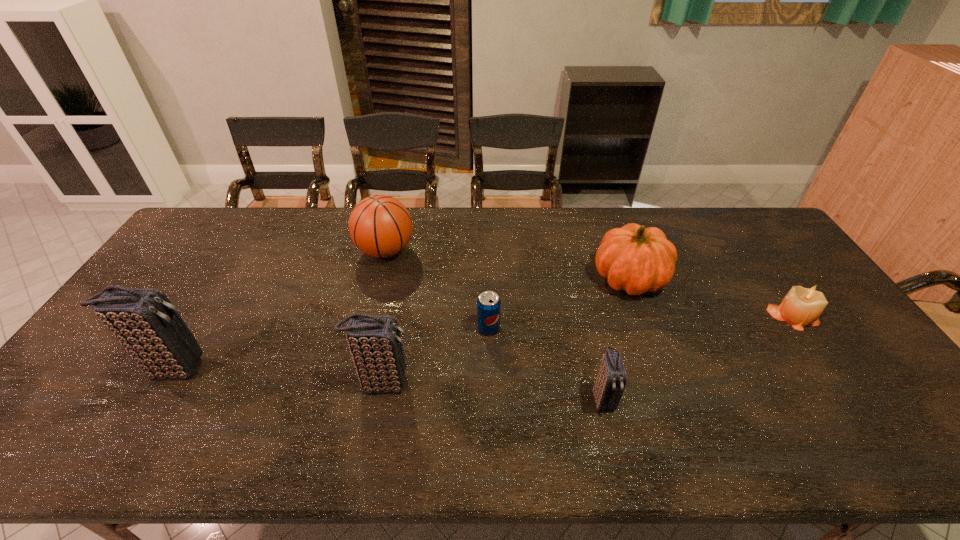
The height and width of the screenshot is (540, 960). I want to click on the leftmost object, so click(x=145, y=322).

This screenshot has height=540, width=960. In order to click on the second shortest clutch bag in this screenshot , I will do `click(375, 345)`.

Where is `the rightmost clutch bag`? The width and height of the screenshot is (960, 540). the rightmost clutch bag is located at coordinates (610, 383).

Where is `the third object from right to left`? the third object from right to left is located at coordinates (610, 383).

I want to click on basketball, so click(380, 226).

Find the location of `pumpkin`. pumpkin is located at coordinates (636, 259).

You are a GUI agent. You are given a task and a screenshot of the screen. Output one action in this format:
    pyautogui.click(x=<x>, y=<y>)
    Task: Click on the rightmost object
    Image resolution: width=960 pixels, height=540 pixels.
    Given the screenshot: What is the action you would take?
    pyautogui.click(x=801, y=307)

You are a GUI agent. You are given a task and a screenshot of the screen. Output one action in this format:
    pyautogui.click(x=<x>, y=<y>)
    Task: Click on the pop soda
    This screenshot has width=960, height=540.
    Given the screenshot: What is the action you would take?
    pyautogui.click(x=488, y=304)

Image resolution: width=960 pixels, height=540 pixels. Find the location of `vacant space located 0.070m with the zip open on the leftmost object`. vacant space located 0.070m with the zip open on the leftmost object is located at coordinates (235, 368).

At what (x,y) coordinates should I click in order to perform the action: click on vacant space situated 0.070m with the zip open on the second tallest clutch bag. Please return your answer as a coordinate pair (x, y). The width and height of the screenshot is (960, 540). Looking at the image, I should click on (440, 383).